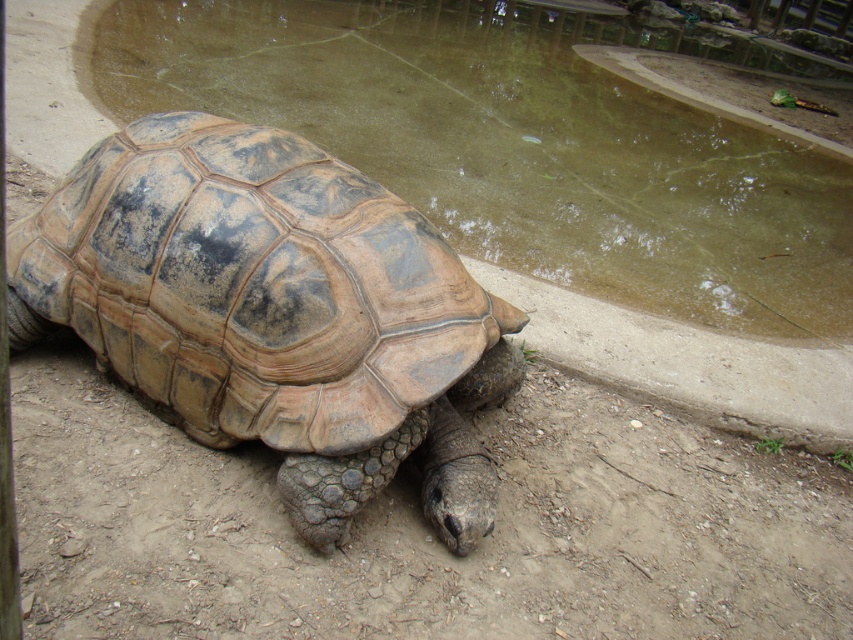
You are standing at the point where the tortoise is located in the enclosure. Looking towards the shallow pool of water in the background, which direction should you turn to face the brown textured concrete at lower left located at point (x=519, y=144)?

The brown textured concrete at lower left is located at point (x=519, y=144), so you should turn to your left to face it.

You are a small insect crawling on the ground near the brown textured concrete at lower left and the brown textured shell at center. Which surface are you closer to?

You are closer to the brown textured concrete at lower left because it is closer to you than the brown textured shell at center, which is further away.

You are a zookeeper who wants to place a new feeding tray for the tortoise. The tray must be placed on the brown textured concrete at lower left or the brown textured shell at center. Which surface is more suitable based on their sizes?

The brown textured concrete at lower left is larger in size compared to the brown textured shell at center, so it is more suitable for placing the feeding tray.